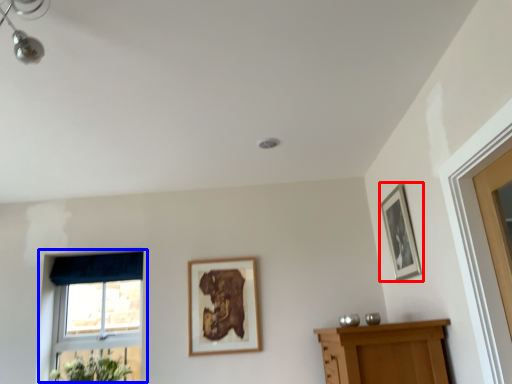
Question: Which object is closer to the camera taking this photo, picture frame (highlighted by a red box) or window (highlighted by a blue box)?

Choices:
 (A) picture frame
 (B) window

Answer: (A)